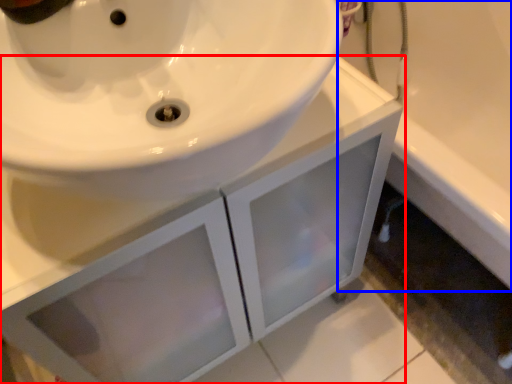
Question: Among these objects, which one is nearest to the camera, bathroom cabinet (highlighted by a red box) or bath (highlighted by a blue box)?

Choices:
 (A) bathroom cabinet
 (B) bath

Answer: (A)